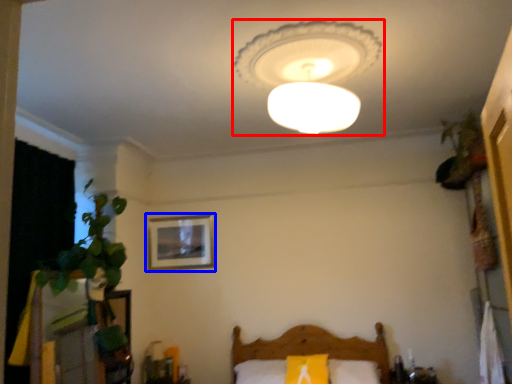
Question: Which of the following is the farthest to the observer, lamp (highlighted by a red box) or picture frame (highlighted by a blue box)?

Choices:
 (A) lamp
 (B) picture frame

Answer: (B)